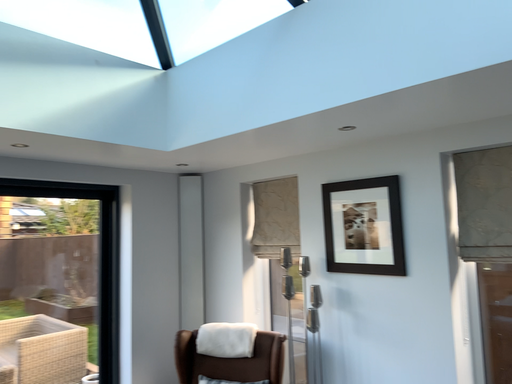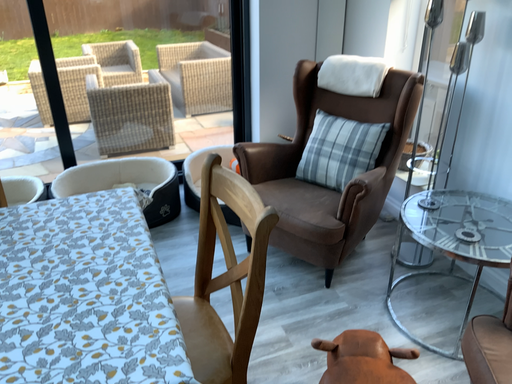
Question: How did the camera likely rotate when shooting the video?

Choices:
 (A) rotated left
 (B) rotated right

Answer: (A)